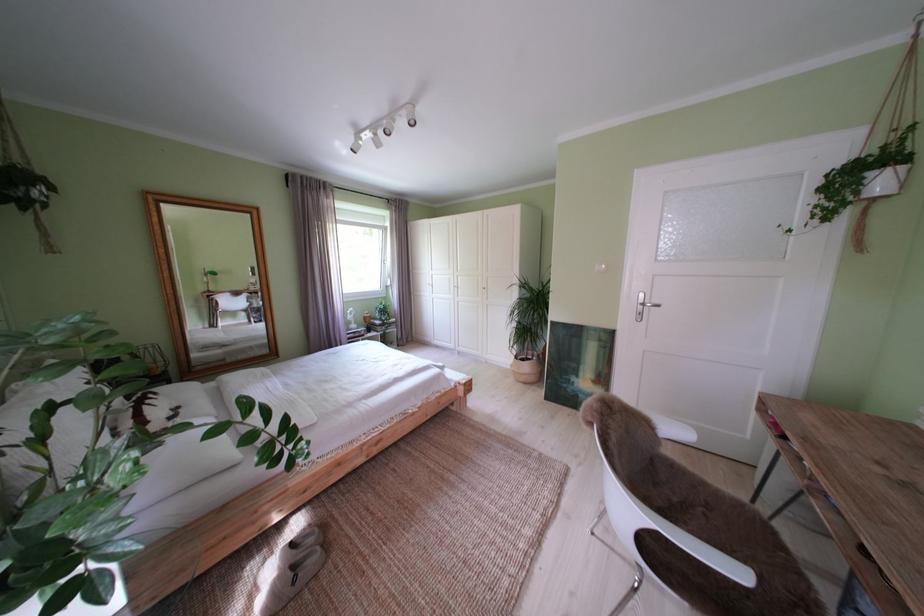
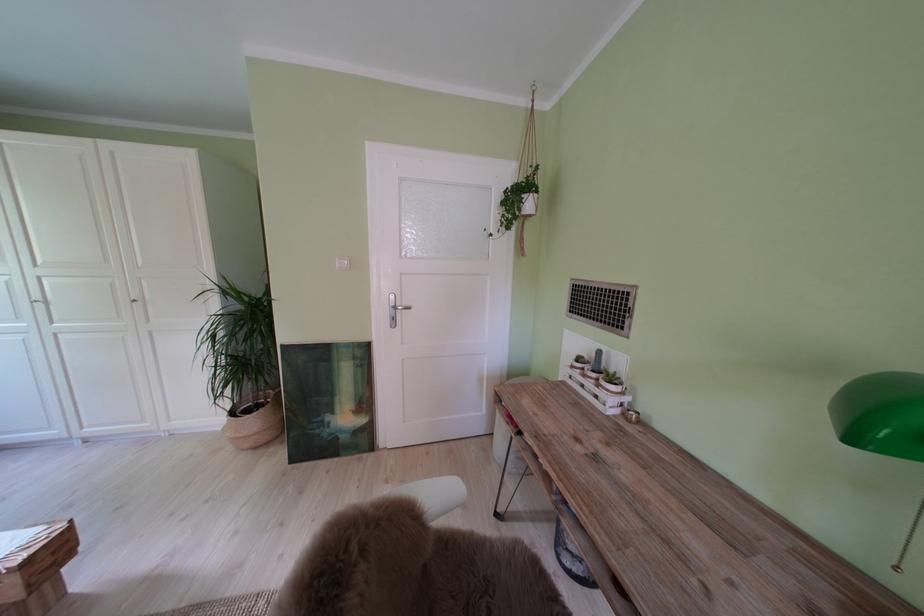
The point at (x=527, y=363) is marked in the first image. Where is the corresponding point in the second image?

(242, 418)